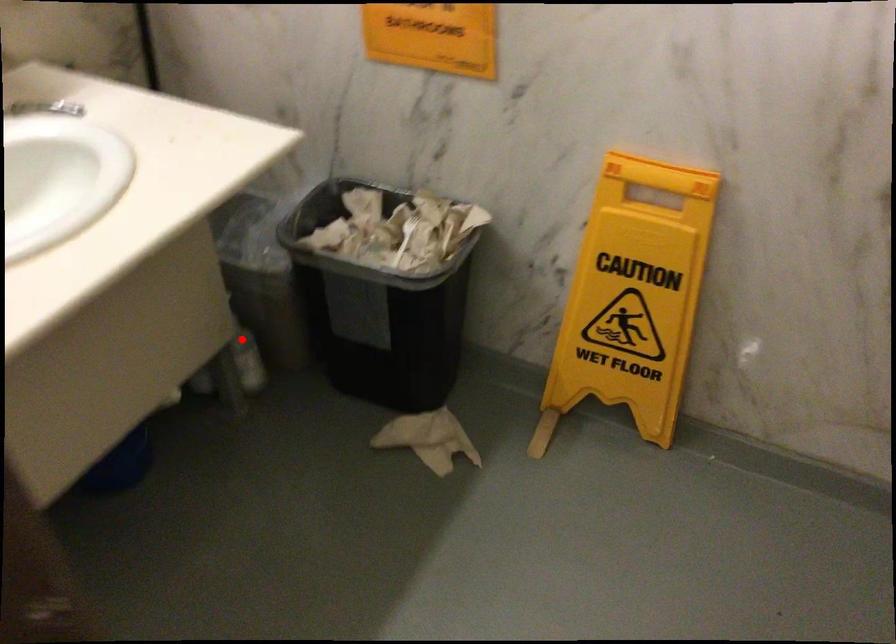
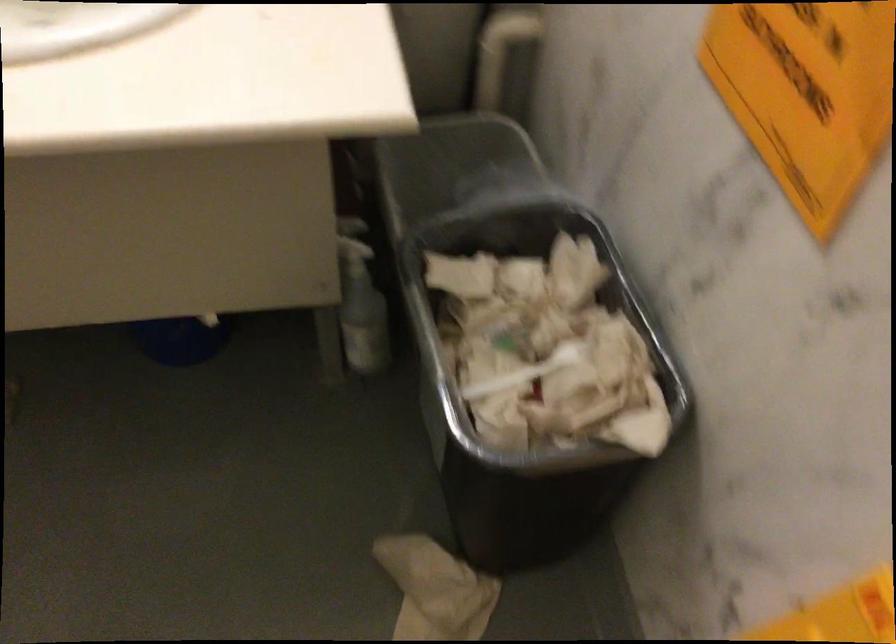
Where in the second image is the point corresponding to the highlighted location from the first image?

(360, 303)